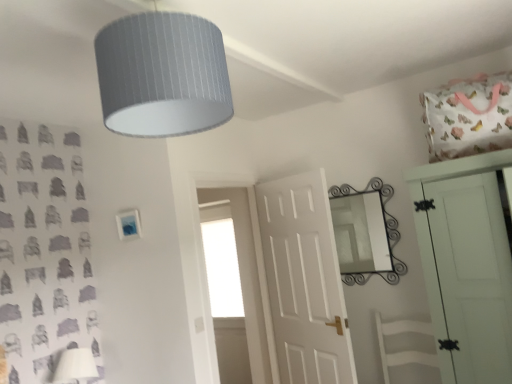
Question: Can you confirm if white matte door at center, placed as the second door when sorted from front to back, is taller than textured gray lampshade at upper center?

Choices:
 (A) no
 (B) yes

Answer: (B)

Question: Is white matte door at center, placed as the second door when sorted from front to back, surrounding textured gray lampshade at upper center?

Choices:
 (A) yes
 (B) no

Answer: (B)

Question: Considering the relative sizes of white matte door at center, which ranks as the first door in left-to-right order, and textured gray lampshade at upper center in the image provided, is white matte door at center, which ranks as the first door in left-to-right order, smaller than textured gray lampshade at upper center?

Choices:
 (A) no
 (B) yes

Answer: (A)

Question: From a real-world perspective, does white matte door at center, which ranks as the 2th door in right-to-left order, sit lower than textured gray lampshade at upper center?

Choices:
 (A) no
 (B) yes

Answer: (B)

Question: Is there a large distance between white matte door at center, placed as the second door when sorted from front to back, and textured gray lampshade at upper center?

Choices:
 (A) yes
 (B) no

Answer: (A)

Question: Considering the positions of point (393, 331) and point (160, 28), is point (393, 331) closer or farther from the camera than point (160, 28)?

Choices:
 (A) closer
 (B) farther

Answer: (B)

Question: In terms of width, does white matte swivel chair at center look wider or thinner when compared to textured gray lampshade at upper center?

Choices:
 (A) wide
 (B) thin

Answer: (A)

Question: Relative to textured gray lampshade at upper center, is white matte swivel chair at center in front or behind?

Choices:
 (A) behind
 (B) front

Answer: (A)

Question: Do you think white matte swivel chair at center is within textured gray lampshade at upper center, or outside of it?

Choices:
 (A) outside
 (B) inside

Answer: (A)

Question: From the image's perspective, is white matte swivel chair at center positioned above or below white matte door at upper right, which appears as the 2th door when viewed from the left?

Choices:
 (A) below
 (B) above

Answer: (A)

Question: Considering the positions of white matte swivel chair at center and white matte door at upper right, positioned as the second door in back-to-front order, in the image, is white matte swivel chair at center wider or thinner than white matte door at upper right, positioned as the second door in back-to-front order,?

Choices:
 (A) wide
 (B) thin

Answer: (B)

Question: In the image, is white matte swivel chair at center on the left side or the right side of white matte door at upper right, positioned as the second door in back-to-front order?

Choices:
 (A) right
 (B) left

Answer: (B)

Question: Is point (409, 331) positioned closer to the camera than point (502, 256)?

Choices:
 (A) closer
 (B) farther

Answer: (B)

Question: Is black wrought iron mirror at upper right wider or thinner than white matte door at upper right, placed as the first door when sorted from front to back?

Choices:
 (A) wide
 (B) thin

Answer: (B)

Question: From the image's perspective, is black wrought iron mirror at upper right positioned above or below white matte door at upper right, which appears as the 2th door when viewed from the left?

Choices:
 (A) below
 (B) above

Answer: (B)